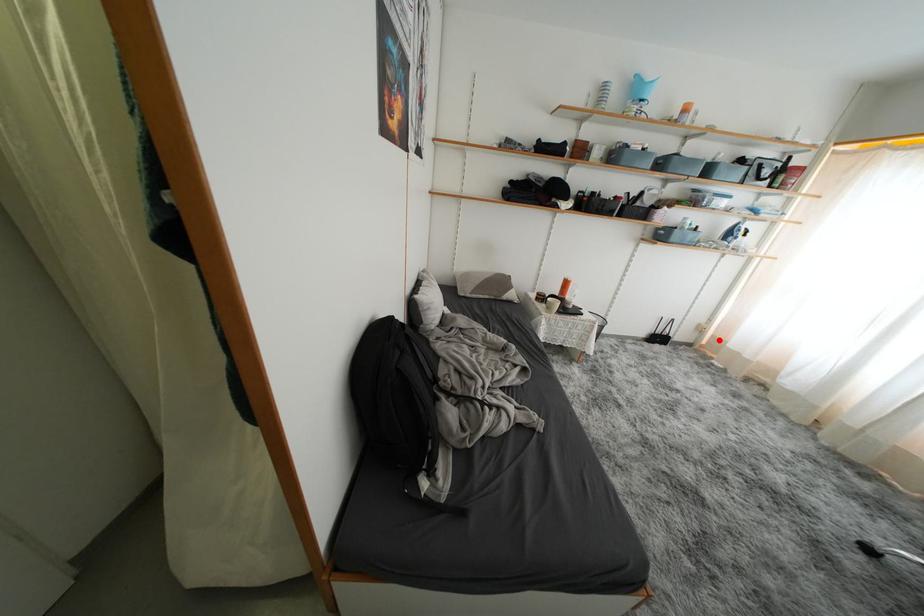
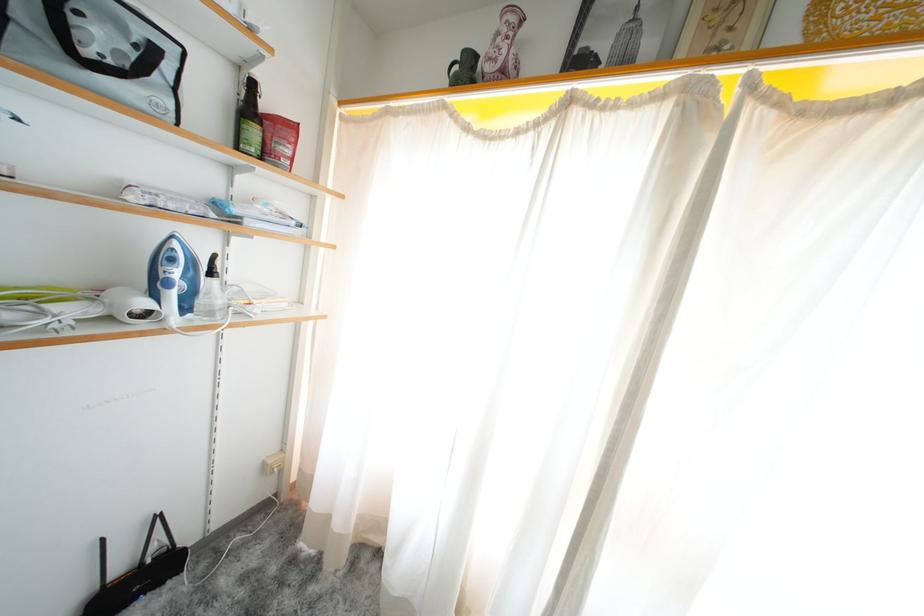
Question: I am providing you with two images of the same scene from different viewpoints. Image1 has a red point marked. In image2, the corresponding 3D location appears at what relative position? Reply with the corresponding letter.

Choices:
 (A) Closer
 (B) Farther

Answer: (B)